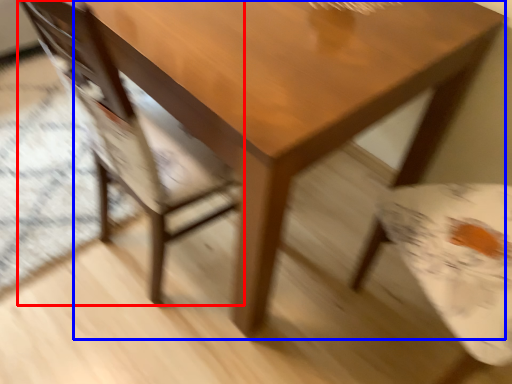
Question: Which of the following is the farthest to the observer, chair (highlighted by a red box) or table (highlighted by a blue box)?

Choices:
 (A) chair
 (B) table

Answer: (B)